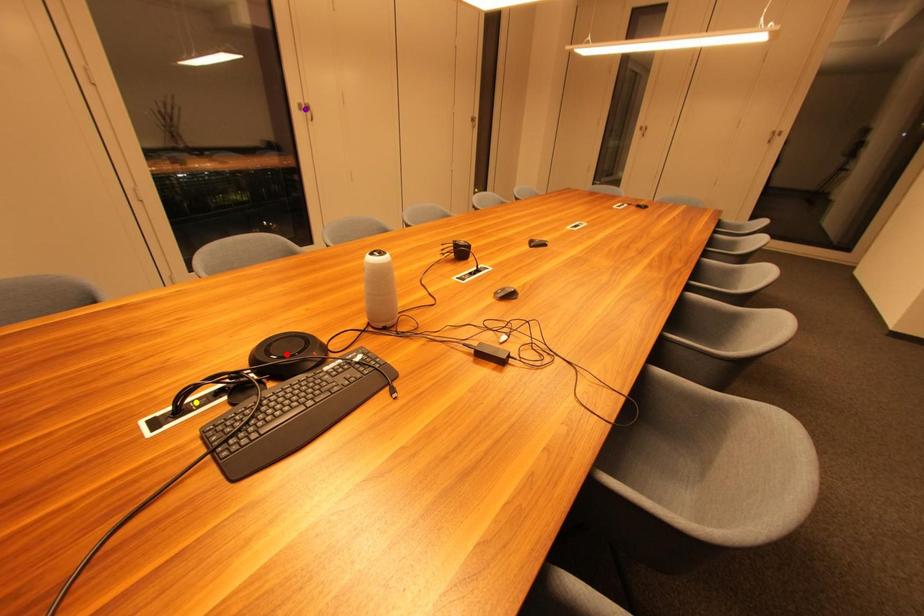
Order these from nearest to farthest:
yellow point, purple point, red point

yellow point
red point
purple point